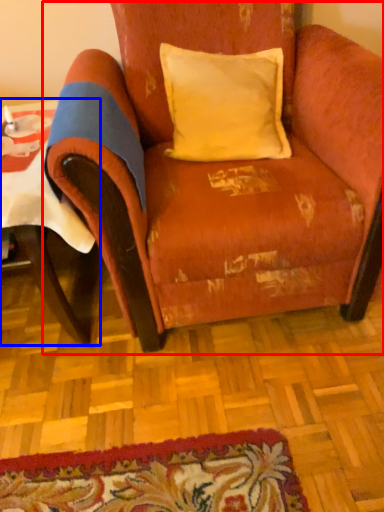
Question: Which point is closer to the camera, chair (highlighted by a red box) or table (highlighted by a blue box)?

Choices:
 (A) chair
 (B) table

Answer: (A)